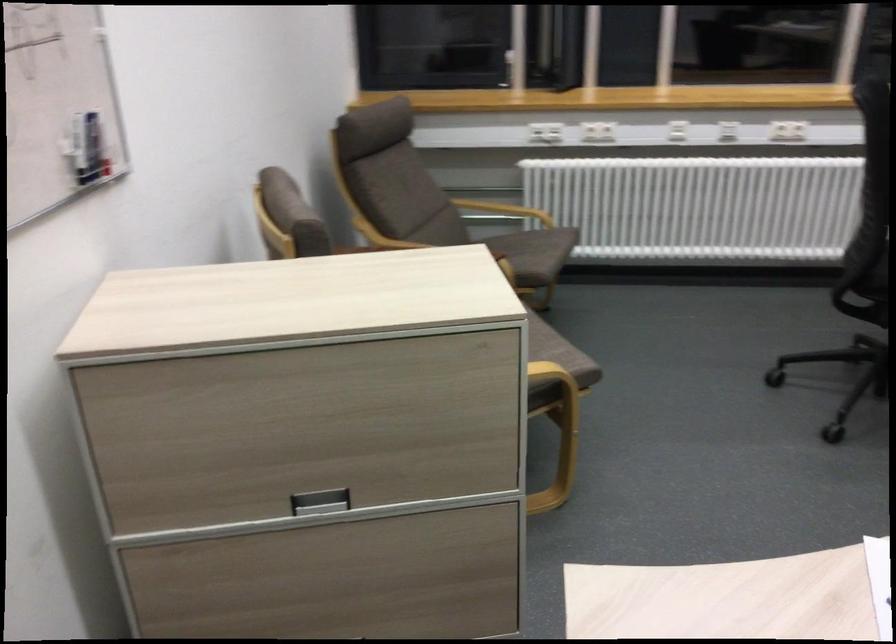
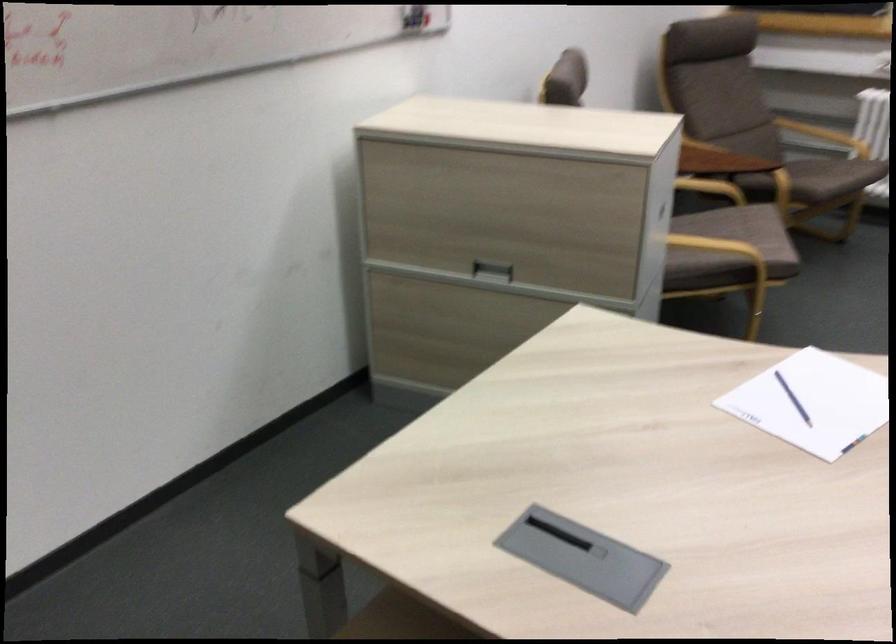
Locate, in the second image, the point that corresponds to pixel 529 375 in the first image.

(721, 249)